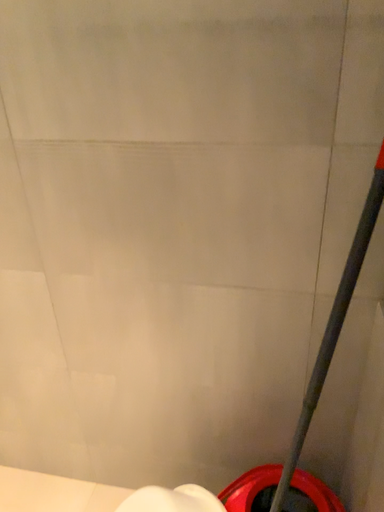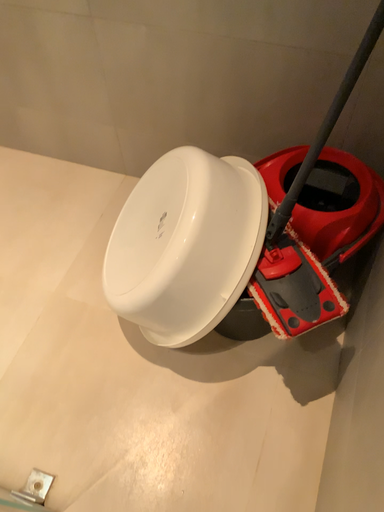
Question: How did the camera likely rotate when shooting the video?

Choices:
 (A) rotated downward
 (B) rotated upward

Answer: (A)